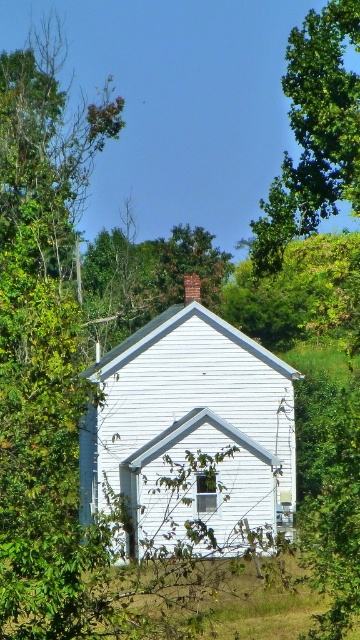
Question: Which point is closer to the camera?

Choices:
 (A) green leafy tree at upper center
 (B) brick chimney at upper center

Answer: (A)

Question: Which point is closer to the camera taking this photo?

Choices:
 (A) (195, 296)
 (B) (336, 180)

Answer: (B)

Question: Does green leafy tree at upper center have a lesser width compared to brick chimney at upper center?

Choices:
 (A) no
 (B) yes

Answer: (A)

Question: Can you confirm if green leafy tree at upper center is bigger than brick chimney at upper center?

Choices:
 (A) yes
 (B) no

Answer: (A)

Question: Which object appears closest to the camera in this image?

Choices:
 (A) green leafy tree at upper center
 (B) brick chimney at upper center

Answer: (A)

Question: Can you confirm if green leafy tree at upper center is positioned to the left of brick chimney at upper center?

Choices:
 (A) no
 (B) yes

Answer: (A)